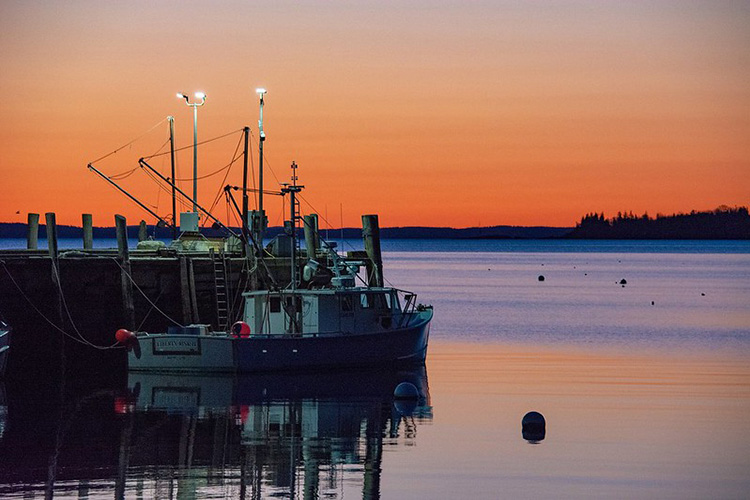
Where is `wires`? This screenshot has height=500, width=750. wires is located at coordinates (198, 134), (214, 171), (122, 146), (128, 169).